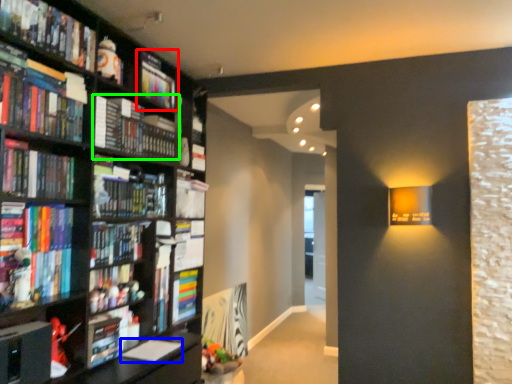
Question: Based on their relative distances, which object is nearer to book (highlighted by a red box)? Choose from paperback book (highlighted by a blue box) and book (highlighted by a green box).

Choices:
 (A) paperback book
 (B) book

Answer: (B)